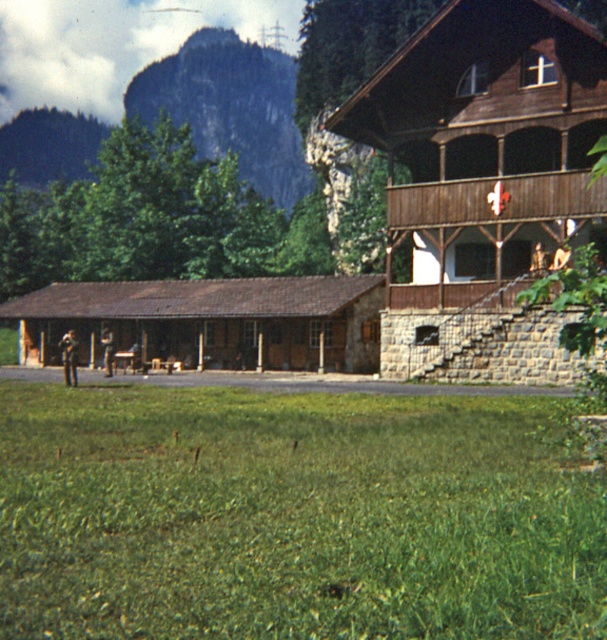
You are standing at the origin point of the image coordinate system. Which direction should you move to reach the green grass at lower center?

The green grass at lower center is located at coordinates point (294, 515), so you should move towards the lower center direction to reach it.

You are planning to set up a tent in the image. The green grass at lower center and the rugged stone mountain at upper left are in your view. Which location would be more suitable for placing your tent based on their positions?

The green grass at lower center is more suitable for placing the tent as it is located below the rugged stone mountain at upper left, providing a flatter and safer area compared to the mountainous terrain.